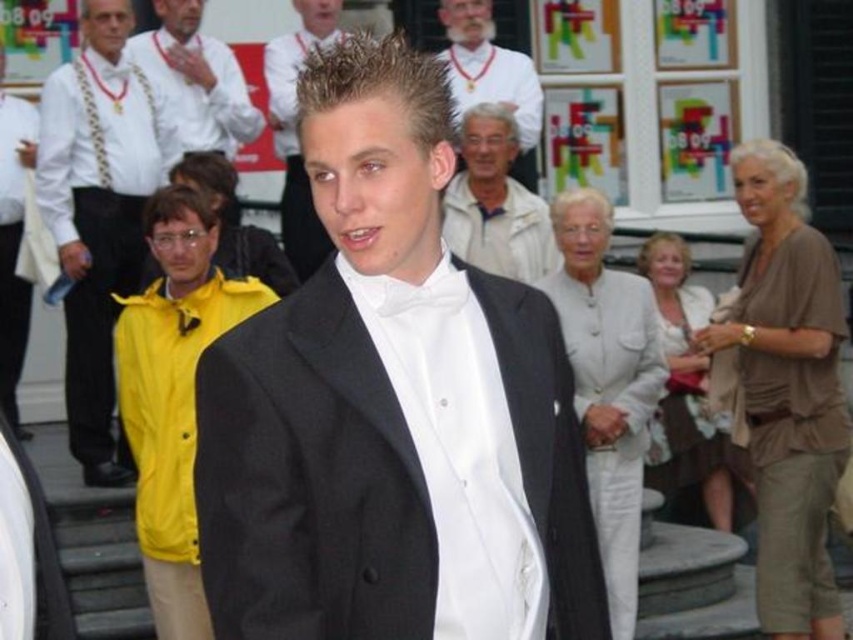
Question: Is white satin bow tie at upper center closer to the viewer compared to satin black suit at center?

Choices:
 (A) no
 (B) yes

Answer: (B)

Question: Is white satin bow tie at upper center to the left of matte yellow jacket at left from the viewer's perspective?

Choices:
 (A) no
 (B) yes

Answer: (A)

Question: Considering the relative positions of white satin bow tie at upper center and matte yellow jacket at left in the image provided, where is white satin bow tie at upper center located with respect to matte yellow jacket at left?

Choices:
 (A) left
 (B) right

Answer: (B)

Question: Estimate the real-world distances between objects in this image. Which object is closer to the white satin dress at center?

Choices:
 (A) yellow fabric jacket at center
 (B) yellow fabric jacket at left

Answer: (A)

Question: Which point is farther to the camera?

Choices:
 (A) black satin tuxedo at center
 (B) white satin shirt at center

Answer: (A)

Question: Based on their relative distances, which object is nearer to the black satin tuxedo at center?

Choices:
 (A) white satin shirt at center
 (B) satin black suit at center
 (C) light beige cotton shirt at center
 (D) white textured bow tie at upper center

Answer: (A)